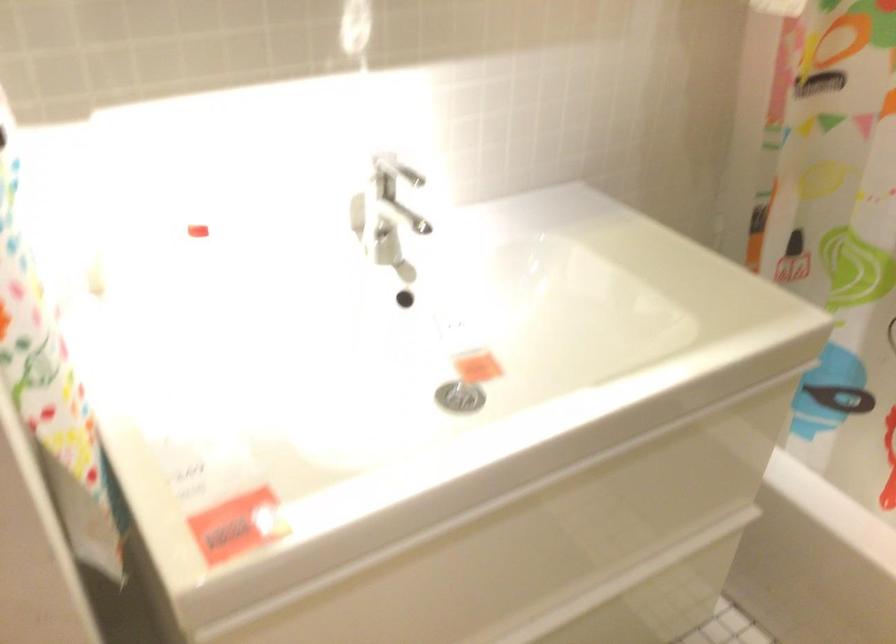
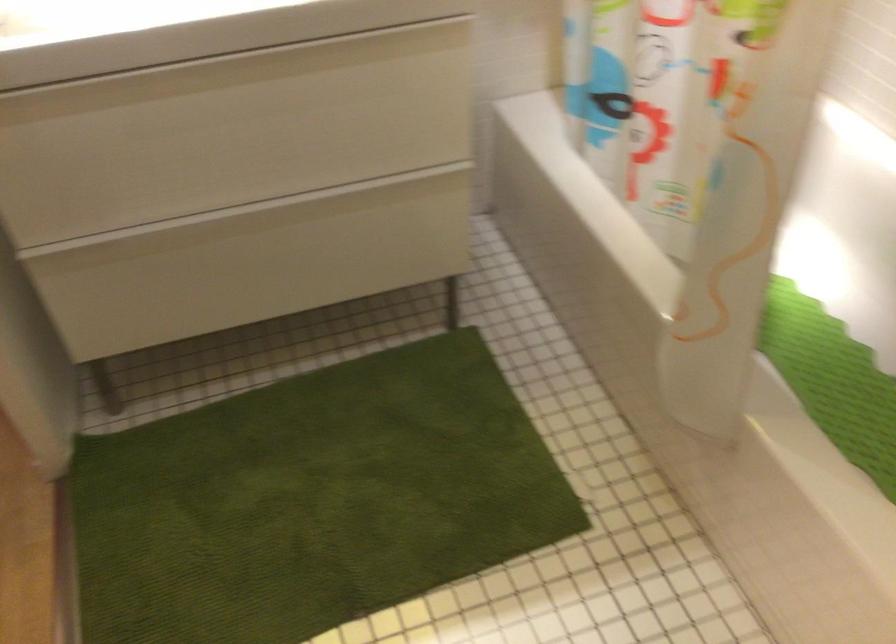
The images are taken continuously from a first-person perspective. In which direction are you moving?

The movement direction of the cameraman is right, backward.